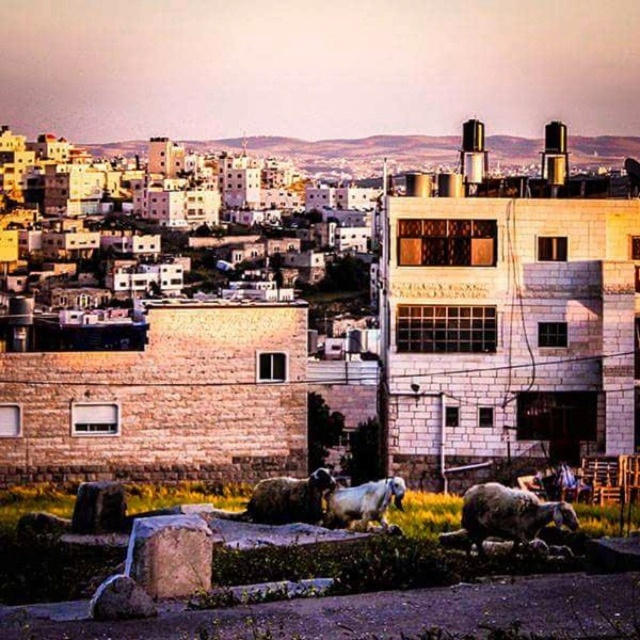
Is the position of brick stone buildings at upper center less distant than that of brown woolen sheep at center?

No, it is not.

Which is more to the right, brick stone buildings at upper center or brown woolen sheep at center?

brick stone buildings at upper center

Locate an element on the screen. brick stone buildings at upper center is located at coordinates (344, 150).

You are a GUI agent. You are given a task and a screenshot of the screen. Output one action in this format:
    pyautogui.click(x=<x>, y=<y>)
    Task: Click on the brick stone buildings at upper center
    The height and width of the screenshot is (640, 640).
    Given the screenshot: What is the action you would take?
    pyautogui.click(x=344, y=150)

Is brick stone buildings at upper center taller than white woolen sheep at lower right?

Yes, brick stone buildings at upper center is taller than white woolen sheep at lower right.

Is brick stone buildings at upper center wider than white woolen sheep at lower right?

Indeed, brick stone buildings at upper center has a greater width compared to white woolen sheep at lower right.

Image resolution: width=640 pixels, height=640 pixels. I want to click on brick stone buildings at upper center, so click(344, 150).

Where is `brick stone buildings at upper center`? Image resolution: width=640 pixels, height=640 pixels. brick stone buildings at upper center is located at coordinates (344, 150).

Between point (332, 168) and point (388, 493), which one is positioned behind?

Positioned behind is point (332, 168).

Does point (276, 156) come behind point (348, 513)?

Yes, it is.

Is point (632, 150) less distant than point (362, 524)?

No, it is behind (362, 524).

You are a GUI agent. You are given a task and a screenshot of the screen. Output one action in this format:
    pyautogui.click(x=<x>, y=<y>)
    Task: Click on the brick stone buildings at upper center
    
    Given the screenshot: What is the action you would take?
    pyautogui.click(x=344, y=150)